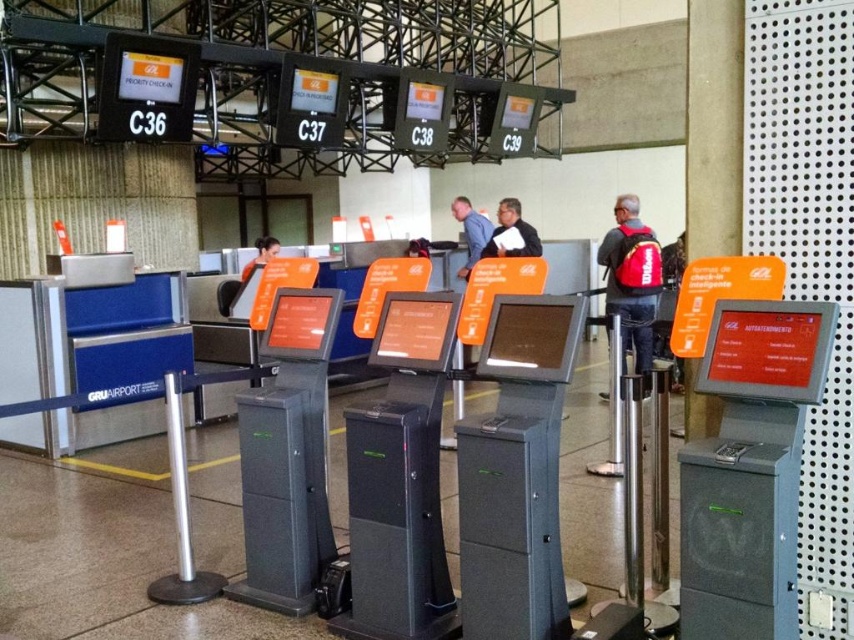
You are standing in the airport checkin area at Gru Airport. You see two points marked on the floor in front of you. The first point is at coordinate point (480, 253) and the second is at coordinate point (268, 246). Which point is closer to you?

Point (480, 253) is closer to the viewer than point (268, 246).

You are standing at the airport checkin area at Gru Airport. You see two points marked in the image. The first point is at coordinate point (x=627, y=260) and the second point is at coordinate point (x=509, y=202). Which point is closer to you?

Point (x=627, y=260) is closer to you than point (x=509, y=202) because the first point is closer to the camera.

You are a traveler at Gru Airport and need to choose between two shirts to wear for your flight. You notice a blue shirt at center and an orange fabric shirt at center in the checkin area. Which shirt is bigger in size?

The blue shirt at center is larger in size compared to the orange fabric shirt at center.